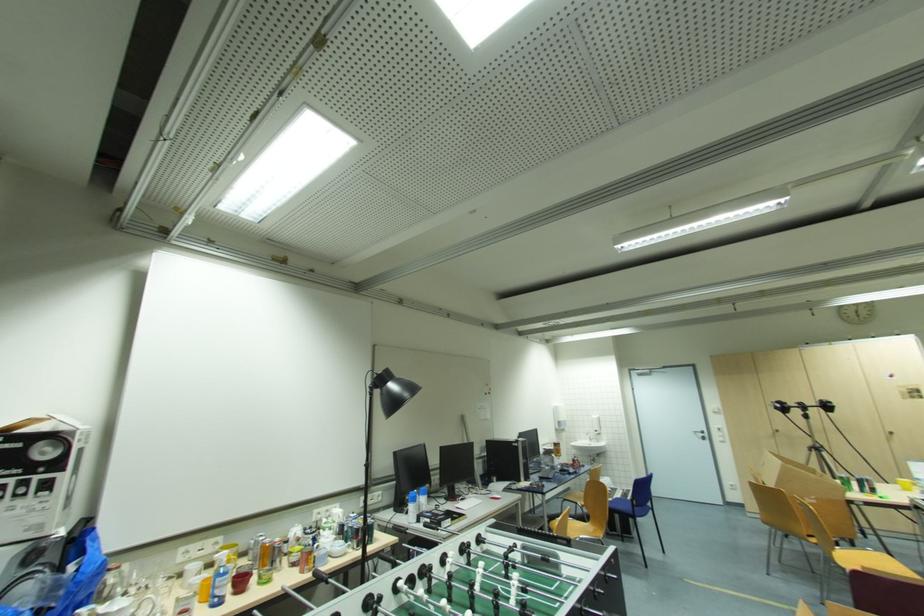
This screenshot has height=616, width=924. Describe the element at coordinates (593, 430) in the screenshot. I see `the soap dispenser pump` at that location.